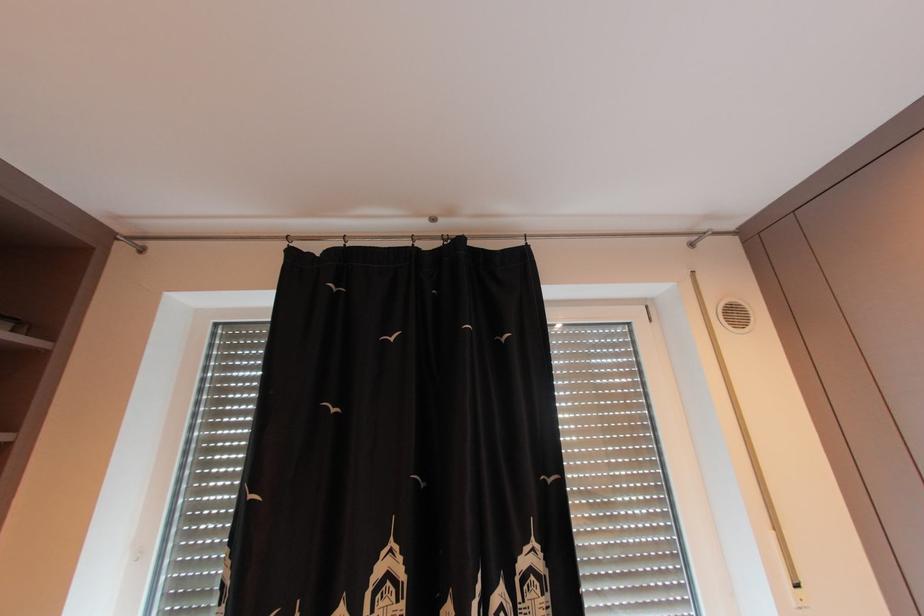
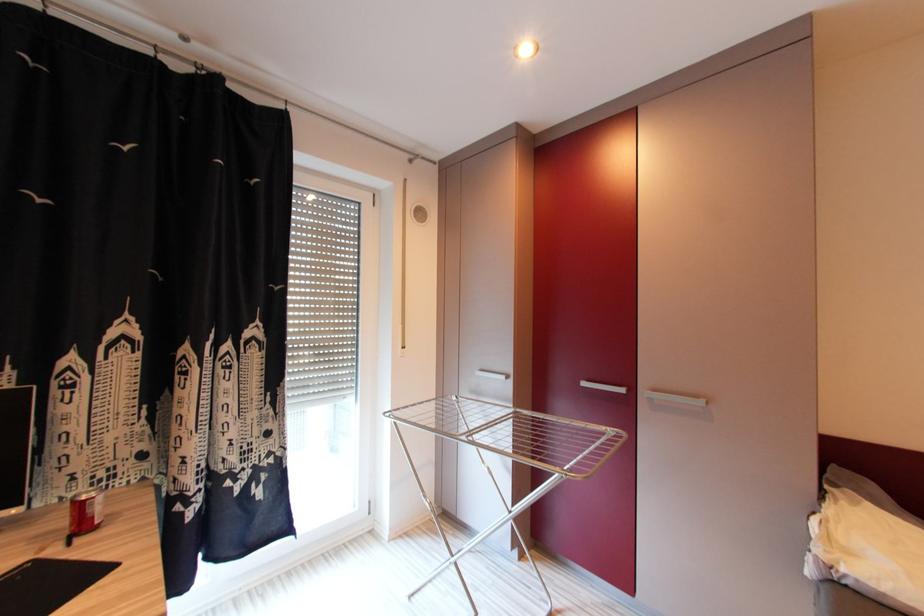
Question: The camera is either moving clockwise (left) or counter-clockwise (right) around the object. The first image is from the beginning of the video and the second image is from the end. Is the camera moving left or right when shooting the video?

Choices:
 (A) Left
 (B) Right

Answer: (A)